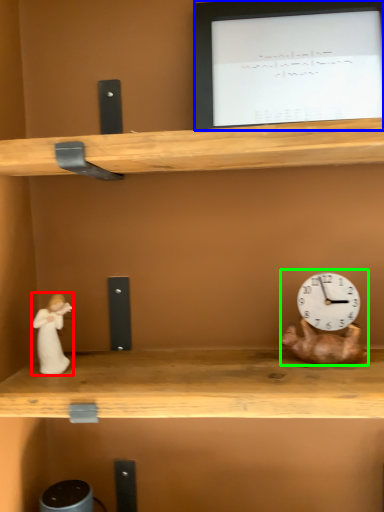
Question: Which object is the farthest from couple (highlighted by a red box)? Choose among these: computer monitor (highlighted by a blue box) or toy (highlighted by a green box).

Choices:
 (A) computer monitor
 (B) toy

Answer: (A)